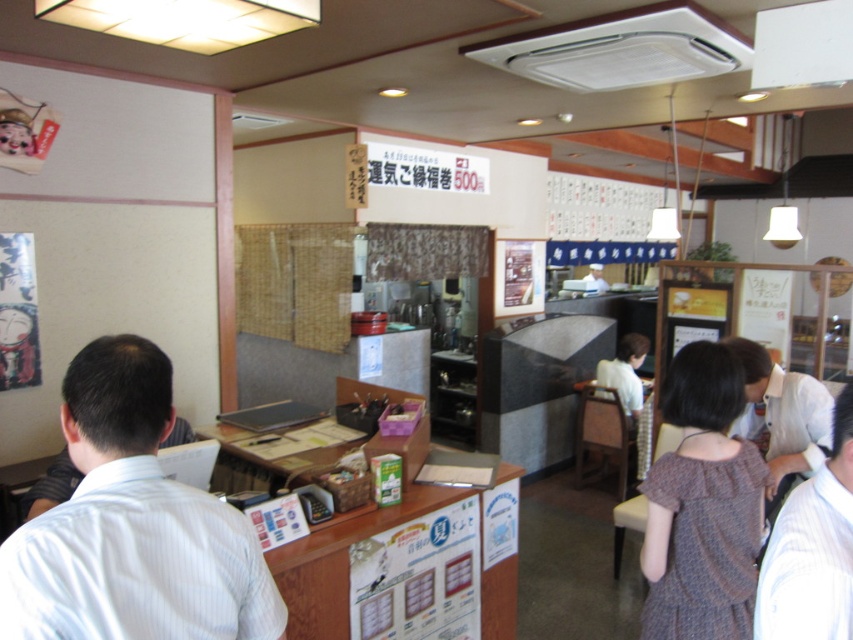
Question: In this image, where is white shirt at right located relative to white uniform at center?

Choices:
 (A) left
 (B) right

Answer: (A)

Question: Estimate the real-world distances between objects in this image. Which object is farther from the white striped shirt at left?

Choices:
 (A) brown textured dress at center
 (B) white uniform at center

Answer: (B)

Question: Which point is closer to the camera?

Choices:
 (A) (596, 284)
 (B) (694, 362)
 (C) (24, 545)

Answer: (C)

Question: Can you confirm if brown textured dress at center is thinner than white shirt at right?

Choices:
 (A) no
 (B) yes

Answer: (A)

Question: Which is nearer to the white shirt at right?

Choices:
 (A) brown textured dress at center
 (B) white striped shirt at left

Answer: (A)

Question: Where is white shirt at right located in relation to white uniform at center in the image?

Choices:
 (A) below
 (B) above

Answer: (A)